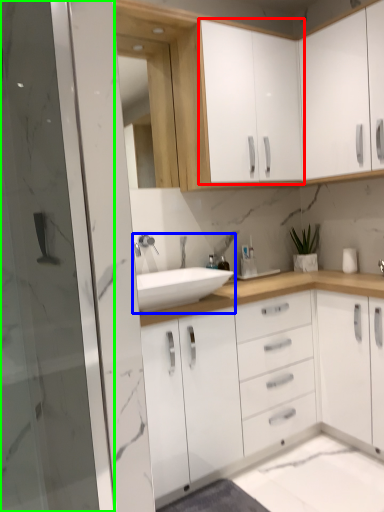
Question: Considering the real-world distances, which object is farthest from cabinetry (highlighted by a red box)? sink (highlighted by a blue box) or screen door (highlighted by a green box)?

Choices:
 (A) sink
 (B) screen door

Answer: (B)